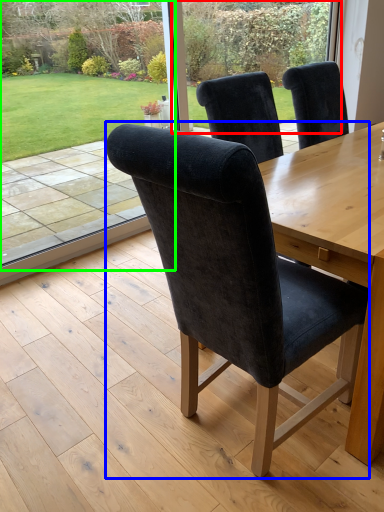
Question: Which object is the farthest from glass door (highlighted by a red box)? Choose among these: chair (highlighted by a blue box) or window screen (highlighted by a green box).

Choices:
 (A) chair
 (B) window screen

Answer: (A)